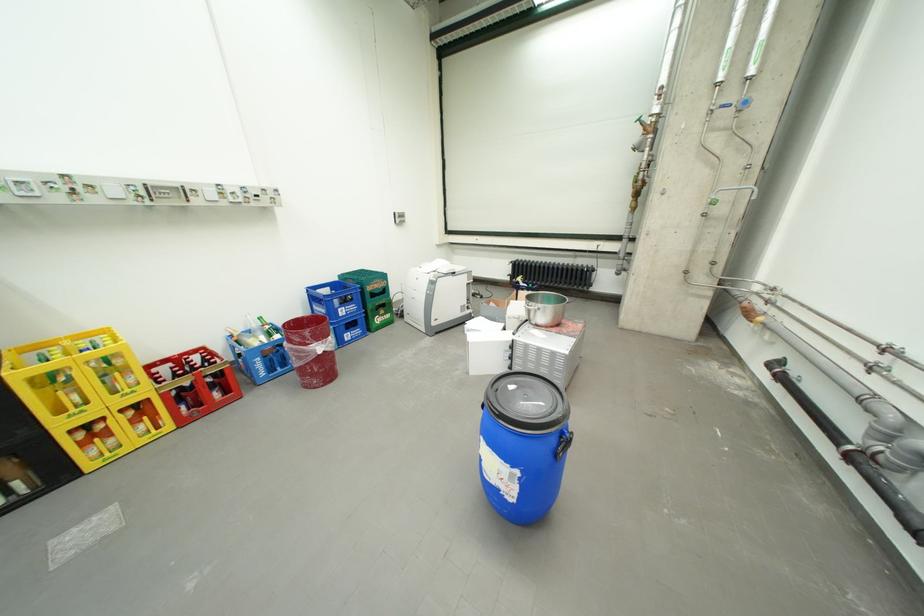
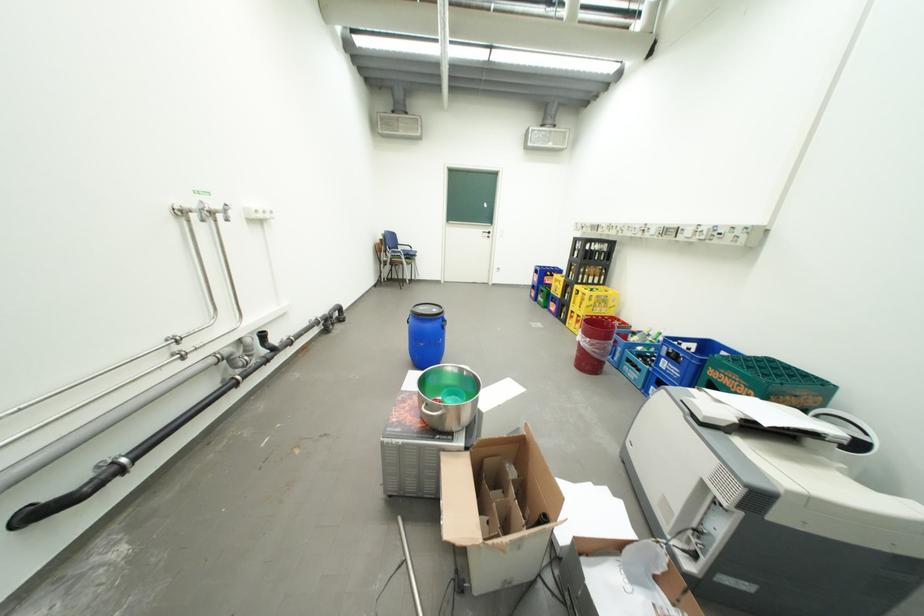
Where in the second image is the point corresponding to (x=578, y=326) from the first image?

(422, 414)